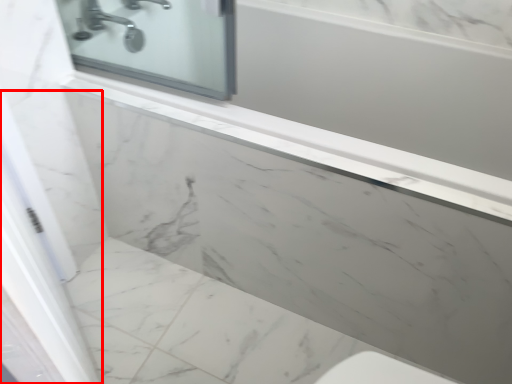
Question: From the image, what is the correct spatial relationship of screen door (annotated by the red box) in relation to tap?

Choices:
 (A) left
 (B) right

Answer: (B)